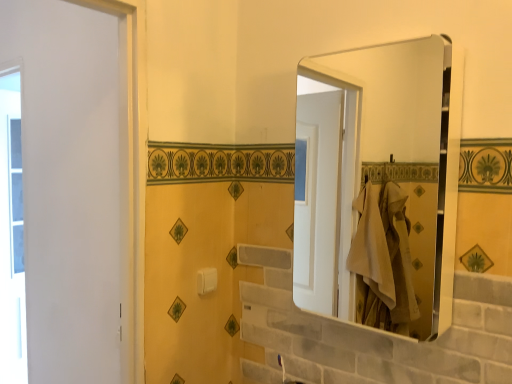
Question: Does transparent glass window at left turn towards white plastic towel bar at center?

Choices:
 (A) no
 (B) yes

Answer: (B)

Question: Considering the relative sizes of transparent glass window at left and white plastic towel bar at center in the image provided, is transparent glass window at left smaller than white plastic towel bar at center?

Choices:
 (A) no
 (B) yes

Answer: (A)

Question: Does transparent glass window at left have a greater height compared to white plastic towel bar at center?

Choices:
 (A) yes
 (B) no

Answer: (A)

Question: Is the position of transparent glass window at left more distant than that of white plastic towel bar at center?

Choices:
 (A) yes
 (B) no

Answer: (A)

Question: Is the depth of transparent glass window at left less than that of white plastic towel bar at center?

Choices:
 (A) no
 (B) yes

Answer: (A)

Question: Is transparent glass window at left taller or shorter than metallic silver mirror at upper right?

Choices:
 (A) short
 (B) tall

Answer: (B)

Question: Considering the positions of transparent glass window at left and metallic silver mirror at upper right in the image, is transparent glass window at left wider or thinner than metallic silver mirror at upper right?

Choices:
 (A) thin
 (B) wide

Answer: (A)

Question: From a real-world perspective, is transparent glass window at left above or below metallic silver mirror at upper right?

Choices:
 (A) below
 (B) above

Answer: (A)

Question: From the image's perspective, is transparent glass window at left positioned above or below metallic silver mirror at upper right?

Choices:
 (A) above
 (B) below

Answer: (B)

Question: Looking at their shapes, would you say white plastic towel bar at center is wider or thinner than transparent glass window at left?

Choices:
 (A) wide
 (B) thin

Answer: (B)

Question: From a real-world perspective, relative to transparent glass window at left, is white plastic towel bar at center vertically above or below?

Choices:
 (A) above
 (B) below

Answer: (A)

Question: Looking at the image, does white plastic towel bar at center seem bigger or smaller compared to transparent glass window at left?

Choices:
 (A) small
 (B) big

Answer: (A)

Question: Would you say white plastic towel bar at center is to the left or to the right of transparent glass window at left in the picture?

Choices:
 (A) left
 (B) right

Answer: (B)

Question: Considering the positions of point (0, 309) and point (214, 283), is point (0, 309) closer or farther from the camera than point (214, 283)?

Choices:
 (A) farther
 (B) closer

Answer: (A)

Question: Is transparent glass window at left inside the boundaries of white plastic towel bar at center, or outside?

Choices:
 (A) inside
 (B) outside

Answer: (B)